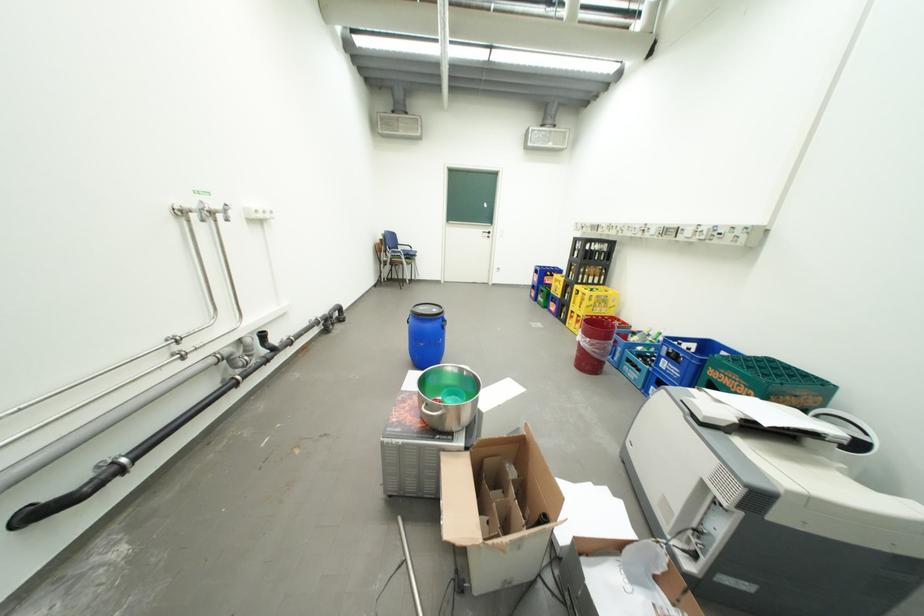
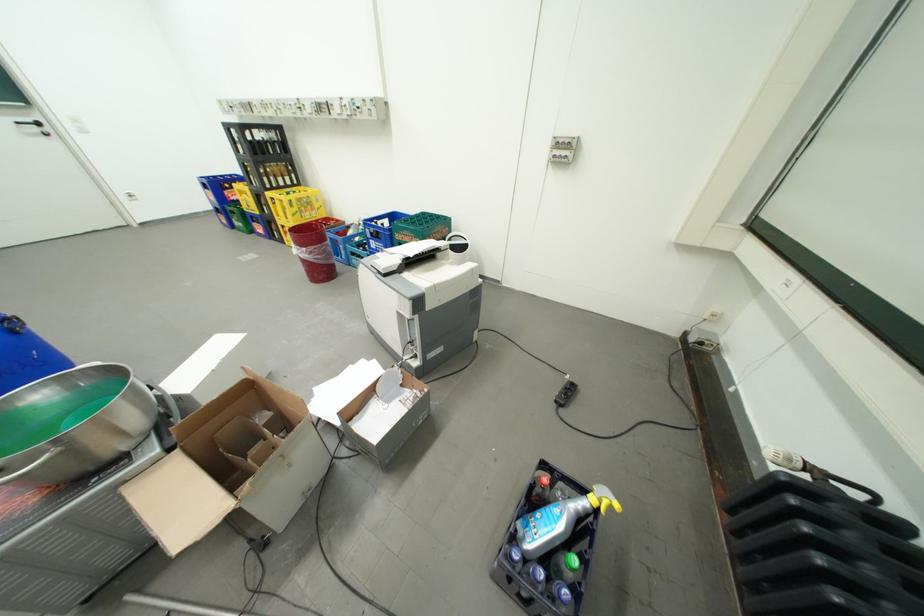
In the second image, find the point that corresponds to (x=676, y=569) in the first image.

(411, 377)